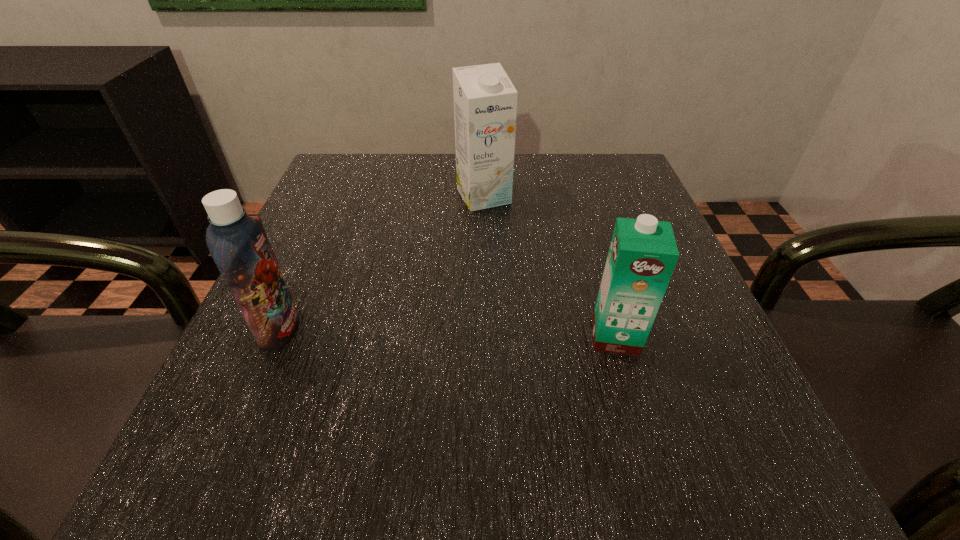
Locate an element on the screen. the second object from left to right is located at coordinates (485, 101).

Locate an element on the screen. The width and height of the screenshot is (960, 540). the taller carton is located at coordinates (485, 101).

At what (x,y) coordinates should I click in order to perform the action: click on the leftmost object. Please return your answer as a coordinate pair (x, y). The width and height of the screenshot is (960, 540). Looking at the image, I should click on (238, 243).

Locate an element on the screen. the nearer carton is located at coordinates (643, 253).

Where is `the shorter carton`? the shorter carton is located at coordinates (643, 253).

This screenshot has width=960, height=540. Find the location of `vacant position located on the right of the second object from left to right`. vacant position located on the right of the second object from left to right is located at coordinates (552, 197).

Find the location of `vacant space located on the front label of the leftmost object`. vacant space located on the front label of the leftmost object is located at coordinates [330, 330].

Locate an element on the screen. free space located on the left of the rightmost object is located at coordinates (558, 336).

This screenshot has height=540, width=960. I want to click on object present at the far edge, so click(x=485, y=101).

This screenshot has width=960, height=540. Identify the location of object at the left edge. (238, 243).